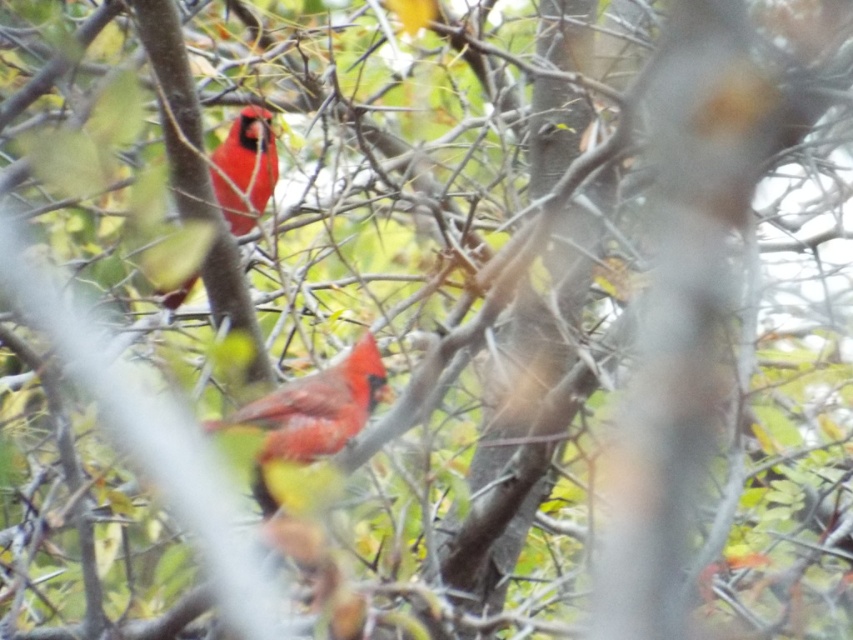
You are a birdwatcher trying to capture both matte red cardinal at center and matte red cardinal at upper left in a single photo. Given that your camera has a 50mm lens, which has a field of view of about 46 degrees, can you estimate if both birds will fit in the frame from your current position? Assume the distance to the nearest bird is 20 feet.

The matte red cardinal at center and matte red cardinal at upper left are 16.47 inches apart. At 20 feet, the 50mm lens with a 46 degree field of view can accommodate this distance, so both birds should fit in the frame.

You are a photographer trying to capture a closeup of the matte red cardinal at center. The camera you are using has a focus point at coordinate point [312,412]. Will this focus point help you capture the bird clearly?

The matte red cardinal at center is located at point [312,412], so yes, the focus point at that coordinate will help capture the bird clearly.

Looking at this image, you are a photographer trying to capture both matte red cardinal at center and matte red cardinal at upper left in a single frame. Given that your camera can only focus on one bird at a time, which bird should you focus on to ensure the larger bird is in focus?

You should focus on the matte red cardinal at center because its width is larger than the matte red cardinal at upper left, making it the bigger bird in the frame.